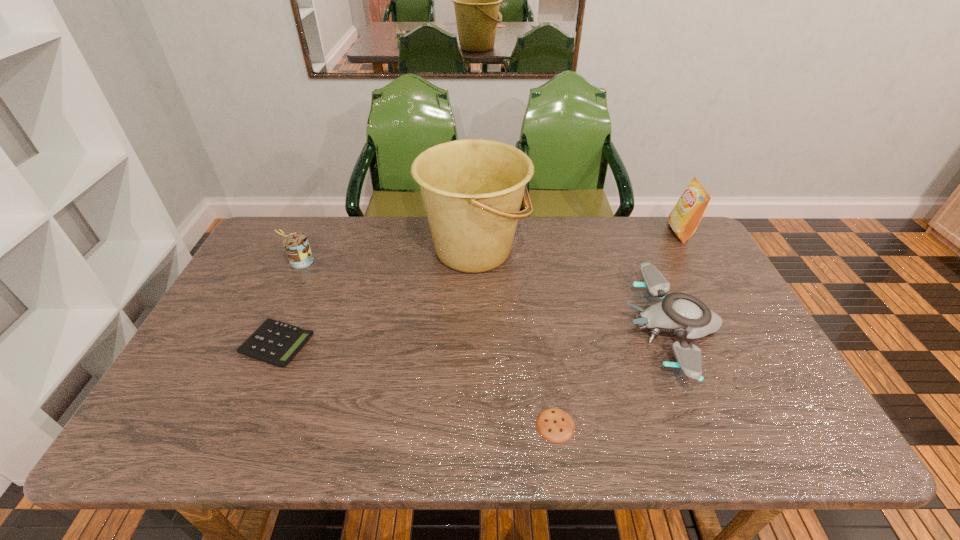
Locate an element on the screen. free space at the near edge of the desktop is located at coordinates pos(245,451).

I want to click on blank space at the far right corner, so click(x=662, y=229).

The width and height of the screenshot is (960, 540). Find the location of `free location at the near right corner`. free location at the near right corner is located at coordinates (779, 427).

Image resolution: width=960 pixels, height=540 pixels. I want to click on free area in between the tallest object and the fourth shortest object, so click(x=387, y=256).

Locate an element on the screen. blank region between the can and the second object from right to left is located at coordinates [x=486, y=295].

Where is `vacant space in between the third tallest object and the calculator`? vacant space in between the third tallest object and the calculator is located at coordinates (289, 303).

Find the location of a particular element. The image size is (960, 540). free space between the shortest object and the fifth tallest object is located at coordinates (417, 384).

This screenshot has height=540, width=960. Identify the location of free area in between the tallest object and the can. (387, 256).

What are the coordinates of `empty space between the can and the drone` in the screenshot? It's located at (486, 295).

Locate an element on the screen. free space between the cookie and the can is located at coordinates (428, 343).